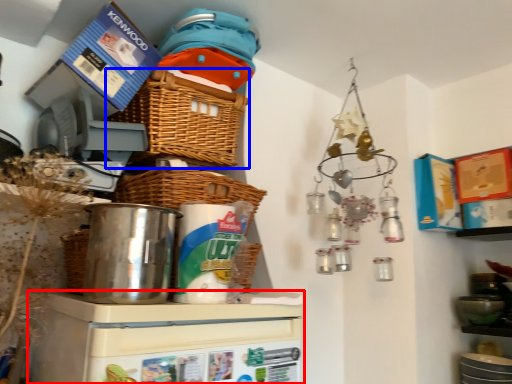
Question: Among these objects, which one is nearest to the camera, appliance (highlighted by a red box) or basket (highlighted by a blue box)?

Choices:
 (A) appliance
 (B) basket

Answer: (A)